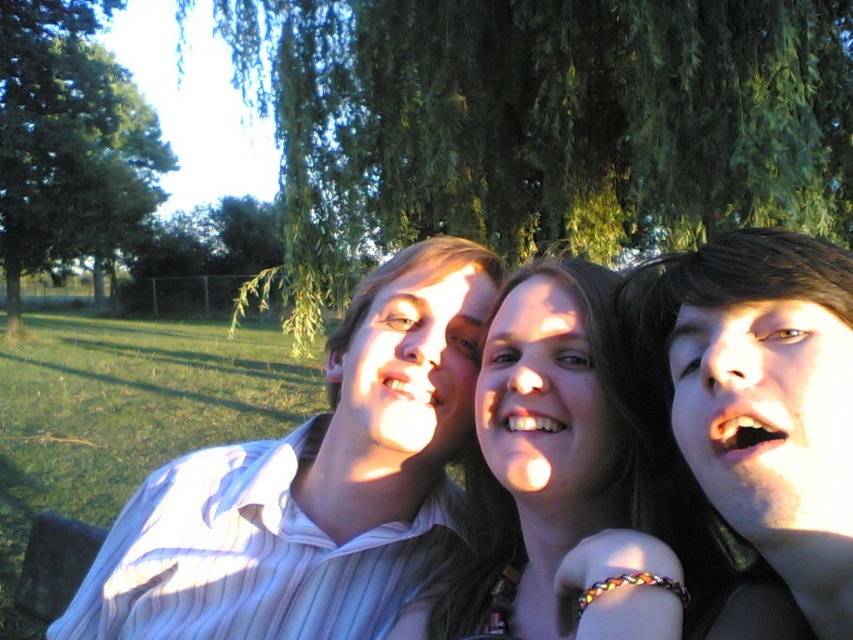
Can you confirm if smooth skin face at center is positioned to the left of matte skin at center?

Incorrect, smooth skin face at center is not on the left side of matte skin at center.

This screenshot has height=640, width=853. What are the coordinates of `smooth skin face at center` in the screenshot? It's located at (755, 403).

Where is `green leafy willow at upper center`? This screenshot has height=640, width=853. green leafy willow at upper center is located at coordinates (543, 122).

Between green leafy willow at upper center and smooth skin face at center, which one has more height?

Standing taller between the two is smooth skin face at center.

Who is more forward, (577, 99) or (730, 460)?

Point (730, 460)

At what (x,y) coordinates should I click in order to perform the action: click on green leafy willow at upper center. Please return your answer as a coordinate pair (x, y). The width and height of the screenshot is (853, 640). Looking at the image, I should click on (543, 122).

Is green leafy willow at upper center smaller than white striped shirt at center?

Yes, green leafy willow at upper center is smaller than white striped shirt at center.

The width and height of the screenshot is (853, 640). What do you see at coordinates (543, 122) in the screenshot?
I see `green leafy willow at upper center` at bounding box center [543, 122].

This screenshot has width=853, height=640. What are the coordinates of `green leafy willow at upper center` in the screenshot? It's located at (543, 122).